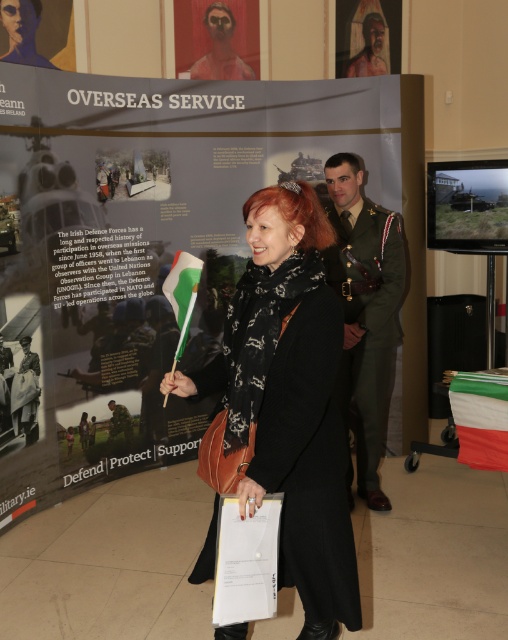
Question: Among these objects, which one is farthest from the camera?

Choices:
 (A) white fabric flag at lower right
 (B) black textured coat at center
 (C) reddish-brown textured face at upper center
 (D) smooth skin portrait at upper center

Answer: (C)

Question: Which object is closer to the camera taking this photo?

Choices:
 (A) reddish-brown textured face at upper center
 (B) white fabric flag at lower right
 (C) green uniform at center
 (D) black textured coat at center

Answer: (D)

Question: Is matte black poster at center above smooth skin portrait at upper left?

Choices:
 (A) no
 (B) yes

Answer: (A)

Question: Which point is farther to the camera?

Choices:
 (A) white fabric flag at lower right
 (B) white fabric flag at center
 (C) black textured coat at center
 (D) matte black poster at center

Answer: (D)

Question: Is white fabric flag at lower right positioned before smooth skin portrait at upper left?

Choices:
 (A) yes
 (B) no

Answer: (A)

Question: Does white fabric flag at lower right have a smaller size compared to smooth skin portrait at upper left?

Choices:
 (A) yes
 (B) no

Answer: (A)